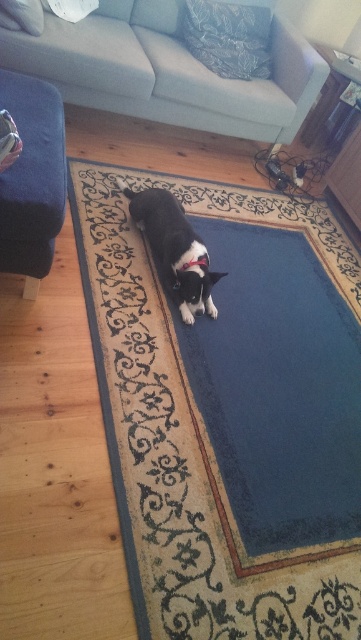
Which is above, black fur dog at center or black fabric neckband at center?

Positioned higher is black fur dog at center.

The width and height of the screenshot is (361, 640). I want to click on black fur dog at center, so click(174, 248).

Between light gray fabric couch at upper center and pink fabric neckband at center, which one is positioned higher?

light gray fabric couch at upper center is higher up.

Who is more distant from viewer, (158,76) or (206,257)?

Point (158,76)

At what (x,y) coordinates should I click in order to perform the action: click on light gray fabric couch at upper center. Please return your answer as a coordinate pair (x, y). This screenshot has height=640, width=361. Looking at the image, I should click on (167, 72).

Which is above, velvet dark blue ottoman at left or black fabric neckband at center?

Positioned higher is velvet dark blue ottoman at left.

Who is lower down, velvet dark blue ottoman at left or black fabric neckband at center?

Positioned lower is black fabric neckband at center.

Is point (15, 120) in front of point (197, 259)?

That is True.

This screenshot has height=640, width=361. I want to click on velvet dark blue ottoman at left, so click(32, 179).